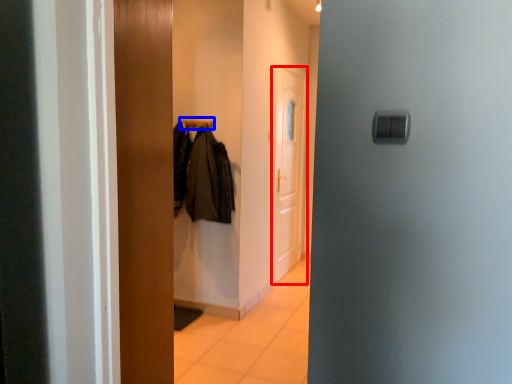
Question: Which point is further to the camera, door (highlighted by a red box) or hanger (highlighted by a blue box)?

Choices:
 (A) door
 (B) hanger

Answer: (A)